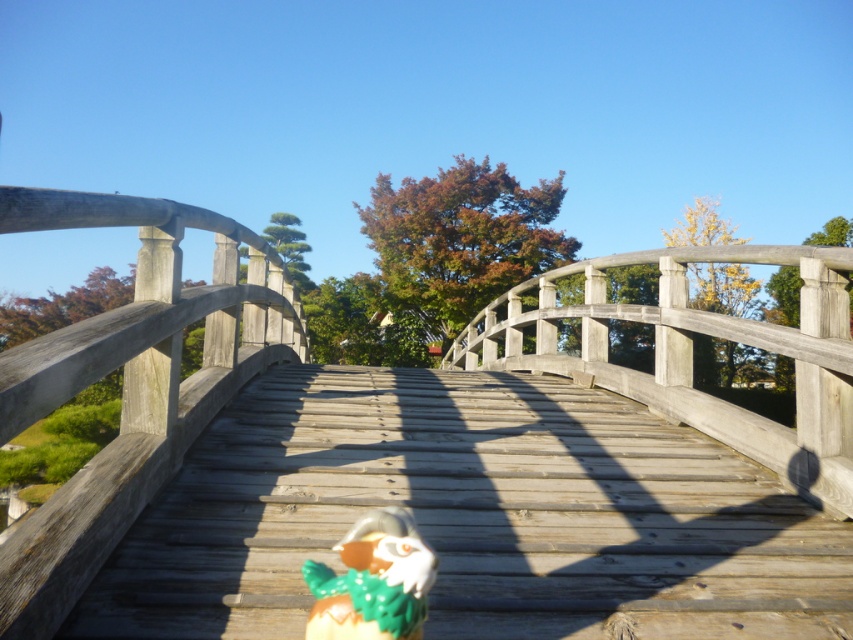
You are standing on the wooden bridge and want to walk from the bird statue to the end of the bridge. Which point, point [79,324] or point [309,584], is closer to the end of the bridge?

Point [309,584] is closer to the end of the bridge because it is in front of point [79,324].

You are a hiker carrying a backpack weighing 20 kilograms. You come across the wooden bridge at center and the shiny metallic toy at center. Given the bridge width, can you safely cross it while avoiding the toy?

The wooden bridge at center has a lesser width compared to shiny metallic toy at center, so the bridge may not be wide enough to safely navigate around the toy. It is recommended to find an alternative path or wait for the toy to be moved.